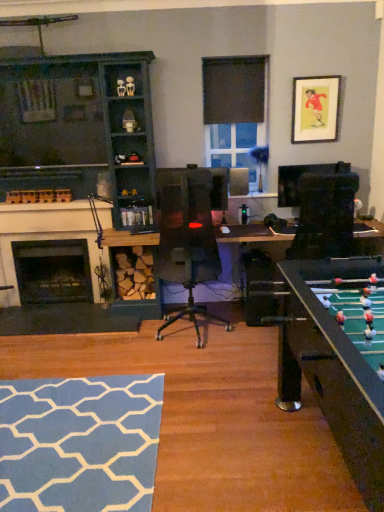
Locate an element on the screen. Image resolution: width=384 pixels, height=512 pixels. free space to the right of dark wood cabinet at left is located at coordinates (198, 346).